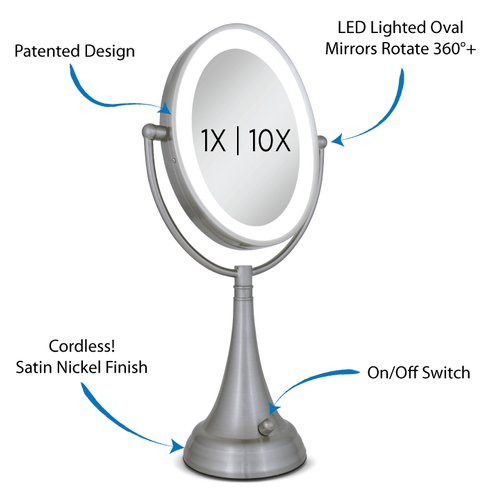
Locate an element on the screen. The height and width of the screenshot is (497, 489). light gray base of mirror is located at coordinates (246, 438).